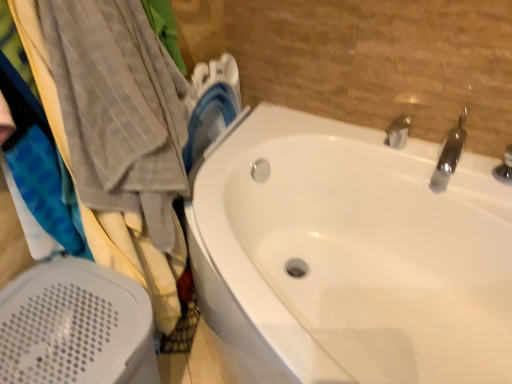
Question: From a real-world perspective, is polished chrome faucet at upper right, acting as the 2th tap starting from the left, under silver metallic tap at upper right, which ranks as the first tap in left-to-right order?

Choices:
 (A) yes
 (B) no

Answer: (B)

Question: Could you tell me if polished chrome faucet at upper right, the first tap when ordered from right to left, is turned towards silver metallic tap at upper right, the 2th tap in the right-to-left sequence?

Choices:
 (A) no
 (B) yes

Answer: (A)

Question: Does polished chrome faucet at upper right, acting as the 2th tap starting from the left, have a larger size compared to silver metallic tap at upper right, the 2th tap in the right-to-left sequence?

Choices:
 (A) no
 (B) yes

Answer: (B)

Question: Is polished chrome faucet at upper right, the first tap when ordered from right to left, shorter than silver metallic tap at upper right, the 2th tap in the right-to-left sequence?

Choices:
 (A) no
 (B) yes

Answer: (A)

Question: Are polished chrome faucet at upper right, acting as the 2th tap starting from the left, and silver metallic tap at upper right, which ranks as the first tap in left-to-right order, beside each other?

Choices:
 (A) yes
 (B) no

Answer: (B)

Question: From the image's perspective, is white plastic bath heater at lower left positioned above or below silver metallic tap at upper right, the 2th tap in the right-to-left sequence?

Choices:
 (A) above
 (B) below

Answer: (B)

Question: In terms of height, does white plastic bath heater at lower left look taller or shorter compared to silver metallic tap at upper right, the 2th tap in the right-to-left sequence?

Choices:
 (A) tall
 (B) short

Answer: (A)

Question: Is white plastic bath heater at lower left bigger or smaller than silver metallic tap at upper right, the 2th tap in the right-to-left sequence?

Choices:
 (A) small
 (B) big

Answer: (B)

Question: Is white plastic bath heater at lower left to the left or to the right of silver metallic tap at upper right, which ranks as the first tap in left-to-right order, in the image?

Choices:
 (A) right
 (B) left

Answer: (B)

Question: Considering the positions of point (87, 327) and point (460, 122), is point (87, 327) closer or farther from the camera than point (460, 122)?

Choices:
 (A) closer
 (B) farther

Answer: (A)

Question: From a real-world perspective, is white plastic bath heater at lower left above or below polished chrome faucet at upper right, acting as the 2th tap starting from the left?

Choices:
 (A) above
 (B) below

Answer: (B)

Question: From the image's perspective, is white plastic bath heater at lower left positioned above or below polished chrome faucet at upper right, acting as the 2th tap starting from the left?

Choices:
 (A) below
 (B) above

Answer: (A)

Question: Considering their positions, is white plastic bath heater at lower left located in front of or behind polished chrome faucet at upper right, the first tap when ordered from right to left?

Choices:
 (A) behind
 (B) front

Answer: (B)

Question: From a real-world perspective, is white glossy bathtub at center physically located above or below white plastic bath heater at lower left?

Choices:
 (A) above
 (B) below

Answer: (B)

Question: Is white glossy bathtub at center in front of or behind white plastic bath heater at lower left in the image?

Choices:
 (A) front
 (B) behind

Answer: (A)